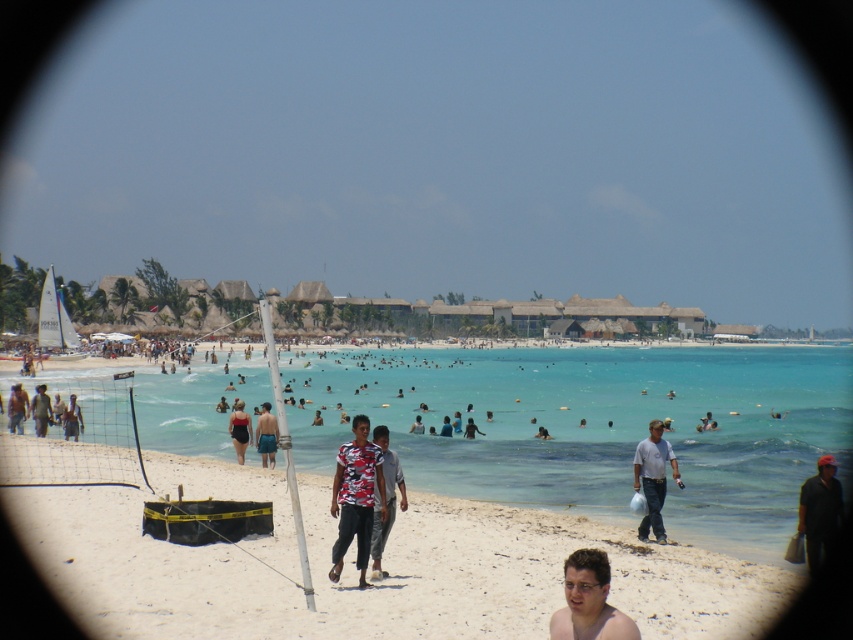
You are a photographer at the beach and want to capture a photo that includes both the shiny tan skin at lower center and the dark gray shirt at lower right. Which object should you adjust your camera angle to focus on first to ensure both are in frame?

The shiny tan skin at lower center is shorter than the dark gray shirt at lower right. To include both in the frame, you should first focus on the shorter object, which is the shiny tan skin at lower center, and then adjust the angle to include the taller dark gray shirt at lower right.